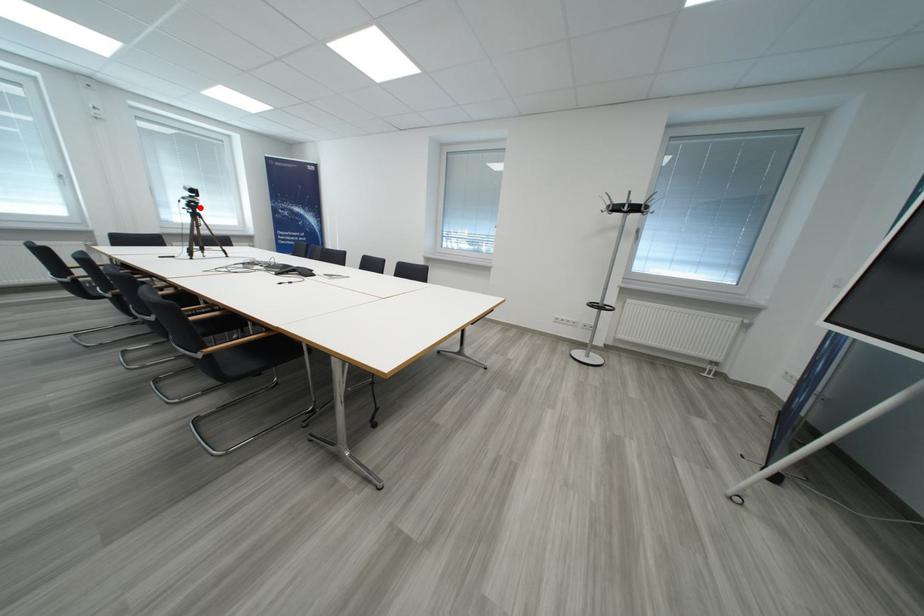
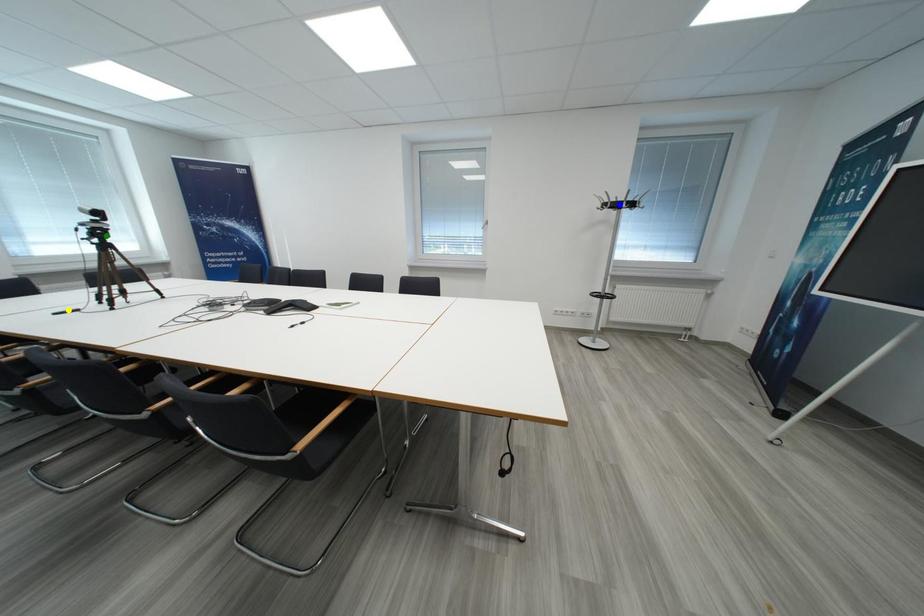
Question: I am providing you with two images of the same scene from different viewpoints. A red point is marked on the first image. You are given multiple points on the second image. Which spot in image 2 lines up with the point in image 1?

Choices:
 (A) blue point
 (B) green point
 (C) yellow point

Answer: (B)